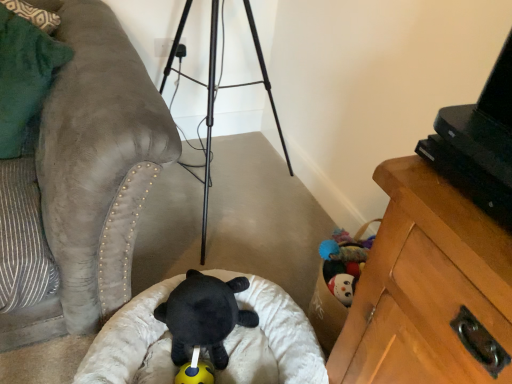
What is the approximate width of black plush bear at center, the 1th toy from the top?

The width of black plush bear at center, the 1th toy from the top, is 10.74 inches.

Consider the image. What is the approximate width of green suede pillow at left?

13.08 inches.

Find the location of a particular element. Image resolution: width=512 pixels, height=384 pixels. green suede pillow at left is located at coordinates (23, 75).

At what (x,y) coordinates should I click in order to perform the action: click on white plush infant bed at center. Please return your answer as a coordinate pair (x, y). Looking at the image, I should click on (271, 338).

From the image's perspective, which object appears higher, green suede pillow at left or yellow rubber ball at center, placed as the second toy when sorted from top to bottom?

green suede pillow at left appears higher in the image.

Is green suede pillow at left to the right of yellow rubber ball at center, placed as the 1th toy when sorted from bottom to top, from the viewer's perspective?

In fact, green suede pillow at left is to the left of yellow rubber ball at center, placed as the 1th toy when sorted from bottom to top.

Is green suede pillow at left closer to camera compared to yellow rubber ball at center, placed as the second toy when sorted from top to bottom?

That is True.

From a real-world perspective, relative to yellow rubber ball at center, placed as the second toy when sorted from top to bottom, is green suede pillow at left vertically above or below?

Clearly, from a real-world perspective, green suede pillow at left is above yellow rubber ball at center, placed as the second toy when sorted from top to bottom.

Based on the photo, between yellow rubber ball at center, placed as the 1th toy when sorted from bottom to top, and black plastic tv at upper right, which one has smaller width?

yellow rubber ball at center, placed as the 1th toy when sorted from bottom to top, is thinner.

Visually, is yellow rubber ball at center, placed as the second toy when sorted from top to bottom, positioned to the left or to the right of black plastic tv at upper right?

yellow rubber ball at center, placed as the second toy when sorted from top to bottom, is positioned on black plastic tv at upper right's left side.

From a real-world perspective, is yellow rubber ball at center, placed as the 1th toy when sorted from bottom to top, above or below black plastic tv at upper right?

yellow rubber ball at center, placed as the 1th toy when sorted from bottom to top, is situated lower than black plastic tv at upper right in the real world.

Consider the image. From a real-world perspective, who is located lower, black plastic tv at upper right or white plush infant bed at center?

white plush infant bed at center.

The image size is (512, 384). What are the coordinates of `computer in front of the white plush infant bed at center` in the screenshot? It's located at (479, 143).

Is black plastic tv at upper right at the right side of white plush infant bed at center?

Indeed, black plastic tv at upper right is positioned on the right side of white plush infant bed at center.

Is black plastic tv at upper right with white plush infant bed at center?

No, black plastic tv at upper right is not making contact with white plush infant bed at center.

Are white plush infant bed at center and black plastic tv at upper right beside each other?

No.

What's the angular difference between white plush infant bed at center and black plastic tv at upper right's facing directions?

The facing directions of white plush infant bed at center and black plastic tv at upper right are 60.5 degrees apart.

From the image's perspective, which object appears higher, white plush infant bed at center or black plastic tv at upper right?

From the image's view, black plastic tv at upper right is above.

Which point is more distant from viewer, (131, 351) or (487, 98)?

The point (131, 351) is farther.

Between black plush bear at center, which appears as the 2th toy when ordered from the bottom, and green suede pillow at left, which one appears on the left side from the viewer's perspective?

From the viewer's perspective, green suede pillow at left appears more on the left side.

From the image's perspective, is black plush bear at center, the 1th toy from the top, on top of green suede pillow at left?

No.

Image resolution: width=512 pixels, height=384 pixels. What are the coordinates of `pillow on the left of black plush bear at center, the 1th toy from the top` in the screenshot? It's located at (23, 75).

Is point (178, 302) farther from camera compared to point (13, 115)?

No, it is in front of (13, 115).

Based on the photo, how distant is white plush infant bed at center from green suede pillow at left?

They are 29.11 inches apart.

Can green suede pillow at left be found inside white plush infant bed at center?

No.

From the image's perspective, is white plush infant bed at center located above or below green suede pillow at left?

white plush infant bed at center is situated lower than green suede pillow at left in the image.

Does white plush infant bed at center turn towards green suede pillow at left?

No.

How distant is yellow rubber ball at center, placed as the second toy when sorted from top to bottom, from black plush bear at center, which appears as the 2th toy when ordered from the bottom?

They are 5.28 inches apart.

Is yellow rubber ball at center, placed as the second toy when sorted from top to bottom, completely or partially outside of black plush bear at center, which appears as the 2th toy when ordered from the bottom?

yellow rubber ball at center, placed as the second toy when sorted from top to bottom, is positioned outside black plush bear at center, which appears as the 2th toy when ordered from the bottom.

Image resolution: width=512 pixels, height=384 pixels. In order to click on toy above the yellow rubber ball at center, placed as the 1th toy when sorted from bottom to top (from a real-world perspective) in this screenshot , I will do `click(204, 315)`.

Find the location of a particular element. pillow above the yellow rubber ball at center, placed as the second toy when sorted from top to bottom (from the image's perspective) is located at coordinates (23, 75).

Locate an element on the screen. computer above the yellow rubber ball at center, placed as the second toy when sorted from top to bottom (from a real-world perspective) is located at coordinates (479, 143).

Considering their positions, is green suede pillow at left positioned further to black plastic tv at upper right than black plush bear at center, which appears as the 2th toy when ordered from the bottom?

Based on the image, green suede pillow at left appears to be further to black plastic tv at upper right.

When comparing their distances from yellow rubber ball at center, placed as the 1th toy when sorted from bottom to top, does black plush bear at center, which appears as the 2th toy when ordered from the bottom, or black plastic tv at upper right seem further?

black plastic tv at upper right lies further to yellow rubber ball at center, placed as the 1th toy when sorted from bottom to top, than the other object.

Based on their spatial positions, is black plastic tv at upper right or white plush infant bed at center further from green suede pillow at left?

Among the two, black plastic tv at upper right is located further to green suede pillow at left.

In the scene shown: Based on their spatial positions, is yellow rubber ball at center, placed as the 1th toy when sorted from bottom to top, or white plush infant bed at center further from black plastic tv at upper right?

yellow rubber ball at center, placed as the 1th toy when sorted from bottom to top, is further to black plastic tv at upper right.

Estimate the real-world distances between objects in this image. Which object is further from black plush bear at center, the 1th toy from the top, black plastic tv at upper right or green suede pillow at left?

The object further to black plush bear at center, the 1th toy from the top, is black plastic tv at upper right.

Looking at the image, which one is located closer to green suede pillow at left, black plastic tv at upper right or yellow rubber ball at center, placed as the 1th toy when sorted from bottom to top?

Based on the image, yellow rubber ball at center, placed as the 1th toy when sorted from bottom to top, appears to be nearer to green suede pillow at left.

When comparing their distances from yellow rubber ball at center, placed as the 1th toy when sorted from bottom to top, does black plastic tv at upper right or black plush bear at center, the 1th toy from the top, seem closer?

The object closer to yellow rubber ball at center, placed as the 1th toy when sorted from bottom to top, is black plush bear at center, the 1th toy from the top.

From the image, which object appears to be nearer to green suede pillow at left, yellow rubber ball at center, placed as the second toy when sorted from top to bottom, or black plastic tv at upper right?

Among the two, yellow rubber ball at center, placed as the second toy when sorted from top to bottom, is located nearer to green suede pillow at left.

Where is `toy between black plastic tv at upper right and yellow rubber ball at center, placed as the 1th toy when sorted from bottom to top, in the front-back direction`? Image resolution: width=512 pixels, height=384 pixels. toy between black plastic tv at upper right and yellow rubber ball at center, placed as the 1th toy when sorted from bottom to top, in the front-back direction is located at coordinates (204, 315).

At what (x,y) coordinates should I click in order to perform the action: click on infant bed between black plastic tv at upper right and yellow rubber ball at center, placed as the 1th toy when sorted from bottom to top, along the z-axis. Please return your answer as a coordinate pair (x, y). The image size is (512, 384). Looking at the image, I should click on (271, 338).

This screenshot has height=384, width=512. I want to click on infant bed between black plush bear at center, the 1th toy from the top, and yellow rubber ball at center, placed as the second toy when sorted from top to bottom, from top to bottom, so click(271, 338).

This screenshot has height=384, width=512. What are the coordinates of `infant bed situated between green suede pillow at left and black plastic tv at upper right from left to right` in the screenshot? It's located at (271, 338).